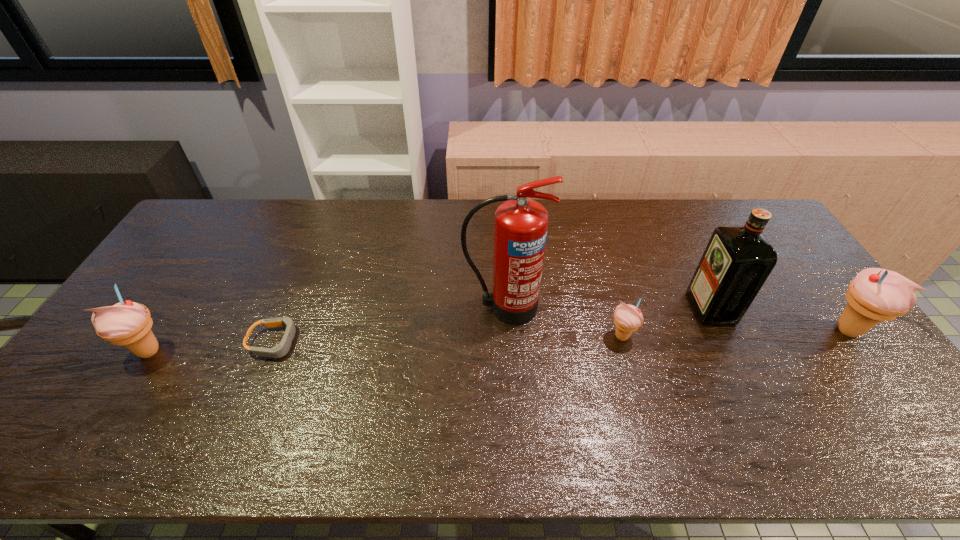
The height and width of the screenshot is (540, 960). What are the coordinates of `vacant space that satisfies the following two spatial constraints: 1. on the surface of the rightmost object; 2. on the left side of the fourth object from right to left` in the screenshot? It's located at (505, 329).

Where is `vacant region that satisfies the following two spatial constraints: 1. on the surface of the rightmost object; 2. on the right side of the tallest object`? vacant region that satisfies the following two spatial constraints: 1. on the surface of the rightmost object; 2. on the right side of the tallest object is located at coordinates (505, 329).

At what (x,y) coordinates should I click in order to perform the action: click on free spot that satisfies the following two spatial constraints: 1. on the front label of the fifth shortest object; 2. on the right side of the rightmost object. Please return your answer as a coordinate pair (x, y). The image size is (960, 540). Looking at the image, I should click on (722, 329).

Find the location of a particular element. The width and height of the screenshot is (960, 540). vacant space that satisfies the following two spatial constraints: 1. on the surface of the rightmost icecream; 2. on the right side of the tallest object is located at coordinates (505, 329).